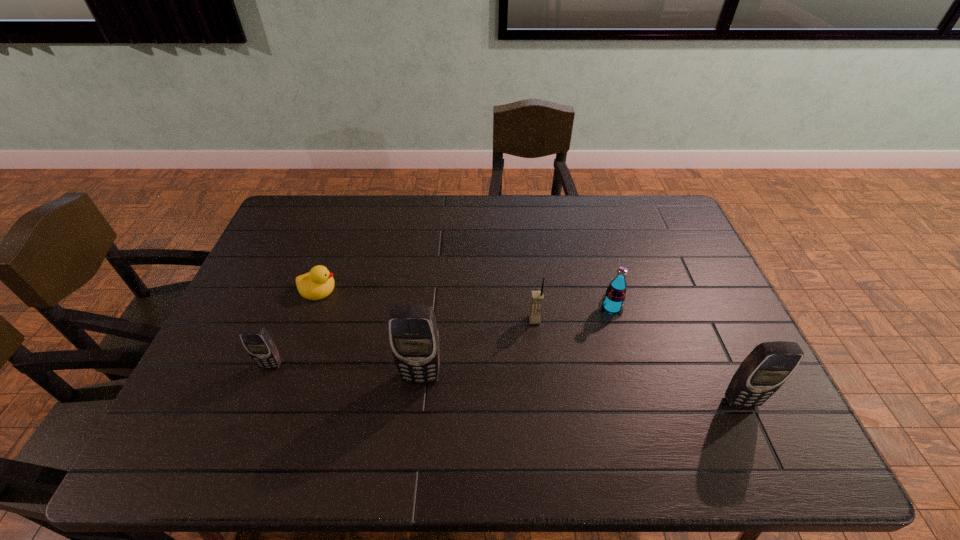
I want to click on vacant space at the far left corner of the desktop, so click(x=311, y=229).

In the image, there is a desktop. Where is `vacant space at the far right corner`? vacant space at the far right corner is located at coordinates (660, 209).

Find the location of `vacant area at the near right corner of the desktop`. vacant area at the near right corner of the desktop is located at coordinates (701, 386).

Find the location of `vacant space in between the second object from right to left and the duckling`. vacant space in between the second object from right to left and the duckling is located at coordinates (466, 298).

Image resolution: width=960 pixels, height=540 pixels. I want to click on free space that is in between the shortest cellular telephone and the fifth object from left to right, so click(442, 336).

You are a GUI agent. You are given a task and a screenshot of the screen. Output one action in this format:
    pyautogui.click(x=<x>, y=<y>)
    Task: Click on the free space that is in between the soda and the leftmost cellular telephone
    This screenshot has width=960, height=540.
    Given the screenshot: What is the action you would take?
    pyautogui.click(x=442, y=336)

At what (x,y) coordinates should I click in order to perform the action: click on empty location between the shortest object and the third cellular telephone from right to left. Please return your answer as a coordinate pair (x, y). Looking at the image, I should click on (370, 333).

Where is `free space between the shortest cellular telephone and the shortest object`? free space between the shortest cellular telephone and the shortest object is located at coordinates (295, 327).

Locate an element on the screen. Image resolution: width=960 pixels, height=540 pixels. vacant point located between the shortest cellular telephone and the soda is located at coordinates (442, 336).

This screenshot has width=960, height=540. In order to click on unoccupied area between the fourth object from right to left and the farthest cellular telephone in this screenshot , I will do `click(478, 348)`.